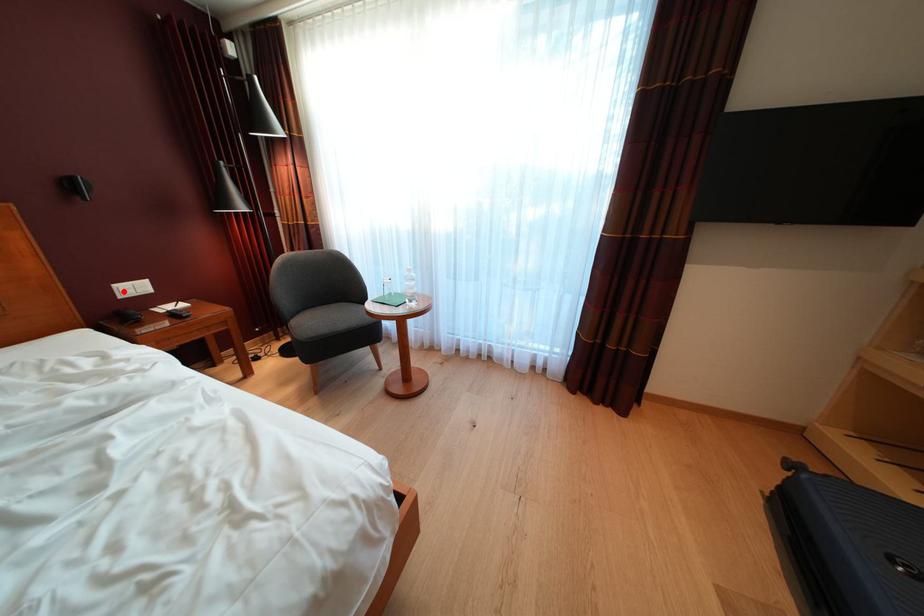
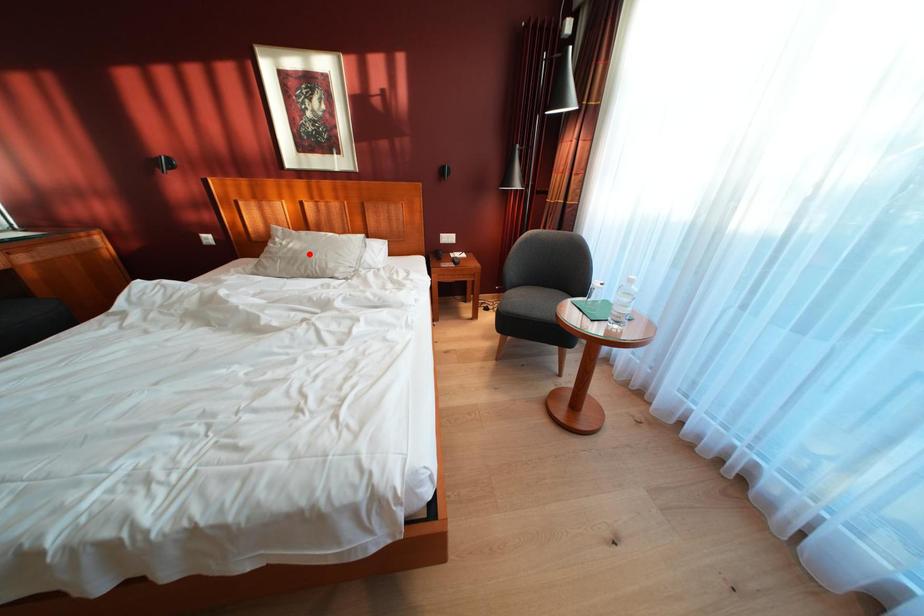
I am providing you with two images of the same scene from different viewpoints. A red point is marked on the first image and another point is marked on the second image. Does the point marked in image1 correspond to the same location as the one in image2?

No